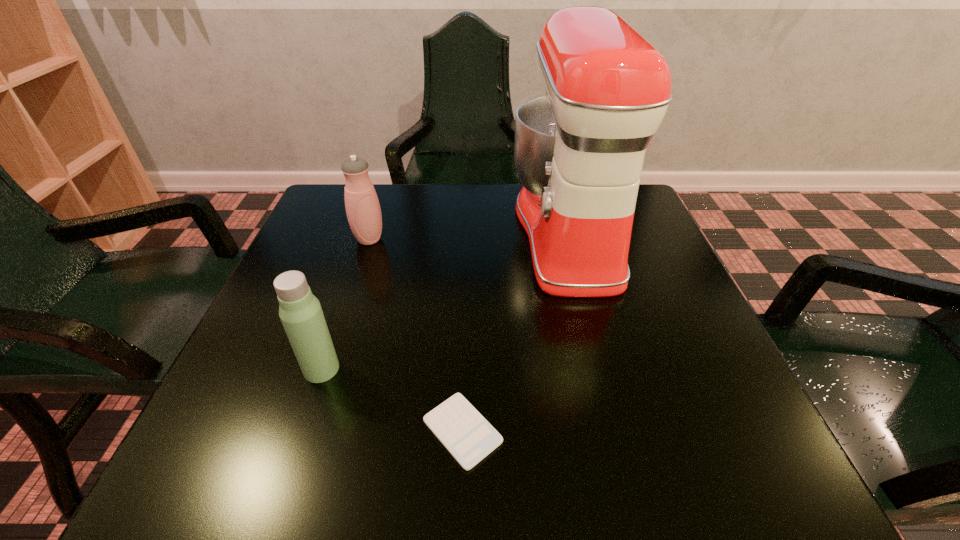
Locate an element on the screen. Image resolution: width=960 pixels, height=540 pixels. vacant region located 0.140m on the right of the third farthest object is located at coordinates (422, 369).

Find the location of `vacant point located on the back of the nearest object`. vacant point located on the back of the nearest object is located at coordinates (465, 369).

At what (x,y) coordinates should I click in order to perform the action: click on mixer positioned at the far edge. Please return your answer as a coordinate pair (x, y). This screenshot has width=960, height=540. Looking at the image, I should click on tap(579, 150).

At what (x,y) coordinates should I click in order to perform the action: click on thermos bottle situated at the far edge. Please return your answer as a coordinate pair (x, y). Looking at the image, I should click on (363, 210).

I want to click on object that is at the near edge, so click(467, 435).

Locate an element on the screen. object located at the right edge is located at coordinates (579, 150).

This screenshot has width=960, height=540. Find the location of `object that is at the far left corner`. object that is at the far left corner is located at coordinates (363, 210).

Find the location of a particular element. This screenshot has height=540, width=960. object that is positioned at the far right corner is located at coordinates (579, 150).

In the image, there is a desktop. Where is `vacant space at the far edge`? The image size is (960, 540). vacant space at the far edge is located at coordinates (408, 198).

In the image, there is a desktop. What are the coordinates of `vacant area at the near edge` in the screenshot? It's located at (627, 434).